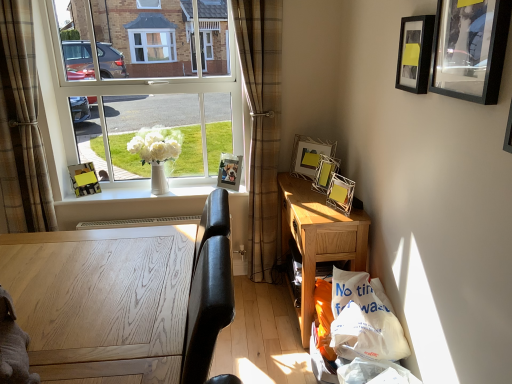
Identify the location of white metallic picture frame at upper right, marked as the third picture frame in a left-to-right arrangement. This screenshot has width=512, height=384. (309, 155).

What is the approximate height of brown plaid curtain at center, the 2th curtain from the left?

The height of brown plaid curtain at center, the 2th curtain from the left, is 5.98 feet.

Measure the distance between brown plaid curtain at center, the first curtain viewed from the right, and camera.

The depth of brown plaid curtain at center, the first curtain viewed from the right, is 2.34 meters.

This screenshot has height=384, width=512. In order to click on metallic silver picture frame at upper right, acting as the 1th picture frame starting from the right in this screenshot , I will do `click(470, 49)`.

Where is `white metallic picture frame at upper right, placed as the 3th picture frame when sorted from back to front`? white metallic picture frame at upper right, placed as the 3th picture frame when sorted from back to front is located at coordinates (309, 155).

There is a yellow cardboard picture frame at upper right, arranged as the third picture frame when viewed from the right. Find the location of `the 3rd picture frame above it (from a real-world perspective)`. the 3rd picture frame above it (from a real-world perspective) is located at coordinates (470, 49).

Considering the relative positions of yellow cardboard picture frame at upper right, the 3th picture frame in the front-to-back sequence, and metallic silver picture frame at upper right, acting as the 1th picture frame starting from the right, in the image provided, is yellow cardboard picture frame at upper right, the 3th picture frame in the front-to-back sequence, behind metallic silver picture frame at upper right, acting as the 1th picture frame starting from the right,?

Yes, yellow cardboard picture frame at upper right, the 3th picture frame in the front-to-back sequence, is further from the camera.

Could you tell me if yellow cardboard picture frame at upper right, arranged as the third picture frame when viewed from the right, is facing metallic silver picture frame at upper right, acting as the 1th picture frame starting from the right?

No, yellow cardboard picture frame at upper right, arranged as the third picture frame when viewed from the right, is not oriented towards metallic silver picture frame at upper right, acting as the 1th picture frame starting from the right.

Is yellow cardboard picture frame at upper right, the 3th picture frame in the front-to-back sequence, at the right side of metallic silver picture frame at upper right, arranged as the sixth picture frame when viewed from the left?

No.

Consider the image. Can you confirm if clear glass window at upper left is shorter than white oak desk at lower left, placed as the second desk when sorted from right to left?

No.

Is clear glass window at upper left bigger than white oak desk at lower left, the first desk viewed from the front?

Actually, clear glass window at upper left might be smaller than white oak desk at lower left, the first desk viewed from the front.

In the image, is clear glass window at upper left on the left side or the right side of white oak desk at lower left, marked as the 1th desk in a left-to-right arrangement?

From the image, it's evident that clear glass window at upper left is to the right of white oak desk at lower left, marked as the 1th desk in a left-to-right arrangement.

Is white metallic picture frame at upper right, placed as the 3th picture frame when sorted from back to front, further to the viewer compared to clear glass window at upper left?

No, it is in front of clear glass window at upper left.

Consider the image. Is white metallic picture frame at upper right, arranged as the fourth picture frame when viewed from the front, wider than clear glass window at upper left?

Yes, white metallic picture frame at upper right, arranged as the fourth picture frame when viewed from the front, is wider than clear glass window at upper left.

The image size is (512, 384). There is a white metallic picture frame at upper right, acting as the 4th picture frame starting from the right. What are the coordinates of `window above it (from a real-world perspective)` in the screenshot? It's located at tap(137, 86).

From the image's perspective, is white metallic picture frame at upper right, acting as the 4th picture frame starting from the right, beneath white plastic bag at lower right?

No, from the image's perspective, white metallic picture frame at upper right, acting as the 4th picture frame starting from the right, is not beneath white plastic bag at lower right.

Which picture frame is the 2nd one when counting from the left side of the white plastic bag at lower right? Please provide its 2D coordinates.

[(309, 155)]

In the image, is white metallic picture frame at upper right, placed as the 3th picture frame when sorted from back to front, positioned in front of or behind white plastic bag at lower right?

Visually, white metallic picture frame at upper right, placed as the 3th picture frame when sorted from back to front, is located behind white plastic bag at lower right.

Could metallic silver photo frame at upper center, the first picture frame when ordered from back to front, be considered to be inside white metallic picture frame at upper right, placed as the 3th picture frame when sorted from back to front?

No.

Measure the distance between white metallic picture frame at upper right, placed as the 3th picture frame when sorted from back to front, and metallic silver photo frame at upper center, acting as the 6th picture frame starting from the front.

white metallic picture frame at upper right, placed as the 3th picture frame when sorted from back to front, and metallic silver photo frame at upper center, acting as the 6th picture frame starting from the front, are 50.03 centimeters apart.

Who is bigger, white metallic picture frame at upper right, arranged as the fourth picture frame when viewed from the front, or metallic silver photo frame at upper center, the first picture frame when ordered from back to front?

With larger size is white metallic picture frame at upper right, arranged as the fourth picture frame when viewed from the front.

Looking at this image, between white metallic picture frame at upper right, marked as the third picture frame in a left-to-right arrangement, and metallic silver photo frame at upper center, the first picture frame when ordered from back to front, which one has smaller width?

white metallic picture frame at upper right, marked as the third picture frame in a left-to-right arrangement.

Is white plastic bag at lower right located outside plaid fabric curtain at left, the first curtain in the left-to-right sequence?

Yes, white plastic bag at lower right is not within plaid fabric curtain at left, the first curtain in the left-to-right sequence.

Which is more to the left, white plastic bag at lower right or plaid fabric curtain at left, the first curtain in the left-to-right sequence?

plaid fabric curtain at left, the first curtain in the left-to-right sequence, is more to the left.

Does white plastic bag at lower right have a greater width compared to plaid fabric curtain at left, the first curtain in the left-to-right sequence?

Correct, the width of white plastic bag at lower right exceeds that of plaid fabric curtain at left, the first curtain in the left-to-right sequence.

From a real-world perspective, relative to plaid fabric curtain at left, which ranks as the second curtain in right-to-left order, is white plastic bag at lower right vertically above or below?

In terms of real-world spatial position, white plastic bag at lower right is below plaid fabric curtain at left, which ranks as the second curtain in right-to-left order.

Could you tell me if metallic silver picture frame at upper right, which appears as the 1th picture frame when viewed from the front, is turned towards white oak desk at lower left, placed as the second desk when sorted from right to left?

No.

Is white oak desk at lower left, which is the second desk from back to front, surrounded by metallic silver picture frame at upper right, which is the sixth picture frame from back to front?

Actually, white oak desk at lower left, which is the second desk from back to front, is outside metallic silver picture frame at upper right, which is the sixth picture frame from back to front.

Which is closer, (500, 11) or (30, 247)?

Point (500, 11) appears to be closer to the viewer than point (30, 247).

Locate an element on the screen. The width and height of the screenshot is (512, 384). the 3rd picture frame positioned below the metallic silver picture frame at upper right, acting as the 1th picture frame starting from the right (from the image's perspective) is located at coordinates (325, 173).

I want to click on window on the right of white oak desk at lower left, placed as the second desk when sorted from right to left, so click(137, 86).

When comparing their distances from light oak desk at center, the 1th desk from the right, does matte black picture frame at window, the fifth picture frame from the front, or brown plaid curtain at center, the 2th curtain from the left, seem closer?

brown plaid curtain at center, the 2th curtain from the left, is positioned closer to the anchor light oak desk at center, the 1th desk from the right.

When comparing their distances from metallic silver photo frame at upper center, which is the second picture frame from left to right, does gray plush toy at lower left or light oak desk at center, the 1th desk from the right, seem further?

gray plush toy at lower left is further to metallic silver photo frame at upper center, which is the second picture frame from left to right.

Looking at the image, which one is located further to plaid fabric curtain at left, which ranks as the second curtain in right-to-left order, metallic silver picture frame at upper right, arranged as the sixth picture frame when viewed from the left, or metallic silver photo frame at upper center, acting as the 6th picture frame starting from the front?

metallic silver picture frame at upper right, arranged as the sixth picture frame when viewed from the left, is positioned further to the anchor plaid fabric curtain at left, which ranks as the second curtain in right-to-left order.

Based on their spatial positions, is brown plaid curtain at center, the 2th curtain from the left, or white plastic bag at lower right further from light oak desk at center, acting as the second desk starting from the left?

brown plaid curtain at center, the 2th curtain from the left, lies further to light oak desk at center, acting as the second desk starting from the left, than the other object.

Looking at the image, which one is located closer to white metallic picture frame at upper right, marked as the third picture frame in a left-to-right arrangement, white plastic bag at lower right or white oak desk at lower left, the first desk viewed from the front?

Based on the image, white plastic bag at lower right appears to be nearer to white metallic picture frame at upper right, marked as the third picture frame in a left-to-right arrangement.

Considering their positions, is matte black picture frame at window, the 1th picture frame in the left-to-right sequence, positioned closer to metallic silver picture frame at upper right, which is the sixth picture frame from back to front, than light oak desk at center, which is the 1th desk in back-to-front order?

Among the two, light oak desk at center, which is the 1th desk in back-to-front order, is located nearer to metallic silver picture frame at upper right, which is the sixth picture frame from back to front.

Which object lies nearer to the anchor point brown plaid curtain at center, the 2th curtain from the left, white glossy vase at center or gray plush toy at lower left?

Based on the image, white glossy vase at center appears to be nearer to brown plaid curtain at center, the 2th curtain from the left.

Estimate the real-world distances between objects in this image. Which object is further from yellow cardboard picture frame at upper right, the 3th picture frame in the front-to-back sequence, gray plush toy at lower left or white oak desk at lower left, placed as the second desk when sorted from right to left?

gray plush toy at lower left is positioned further to the anchor yellow cardboard picture frame at upper right, the 3th picture frame in the front-to-back sequence.

Identify the location of window sill situated between plaid fabric curtain at left, the first curtain in the left-to-right sequence, and metallic silver picture frame at upper right, acting as the 1th picture frame starting from the right, from left to right. Image resolution: width=512 pixels, height=384 pixels. (139, 194).

Locate an element on the screen. Image resolution: width=512 pixels, height=384 pixels. window between plaid fabric curtain at left, which ranks as the second curtain in right-to-left order, and white metallic picture frame at upper right, placed as the 3th picture frame when sorted from back to front, from left to right is located at coordinates (137, 86).

This screenshot has width=512, height=384. Find the location of `desk between white glossy vase at center and yellow cardboard picture frame at upper right, arranged as the fourth picture frame when viewed from the left`. desk between white glossy vase at center and yellow cardboard picture frame at upper right, arranged as the fourth picture frame when viewed from the left is located at coordinates (319, 238).

You are a GUI agent. You are given a task and a screenshot of the screen. Output one action in this format:
    pyautogui.click(x=<x>, y=<y>)
    Task: Click on the window between matte black picture frame at window, acting as the second picture frame starting from the back, and white metallic picture frame at upper right, acting as the 4th picture frame starting from the right, in the horizontal direction
    The height and width of the screenshot is (384, 512).
    Given the screenshot: What is the action you would take?
    pyautogui.click(x=137, y=86)